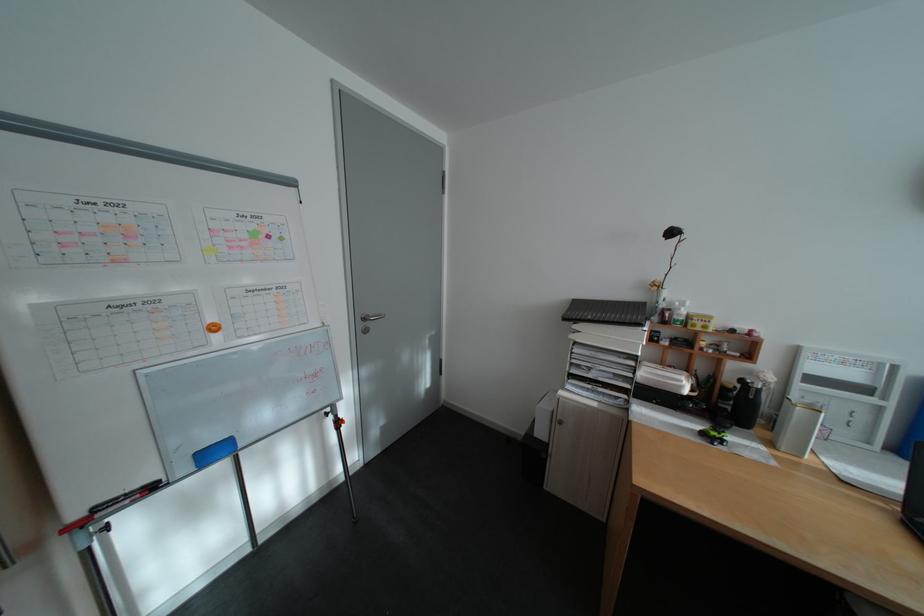
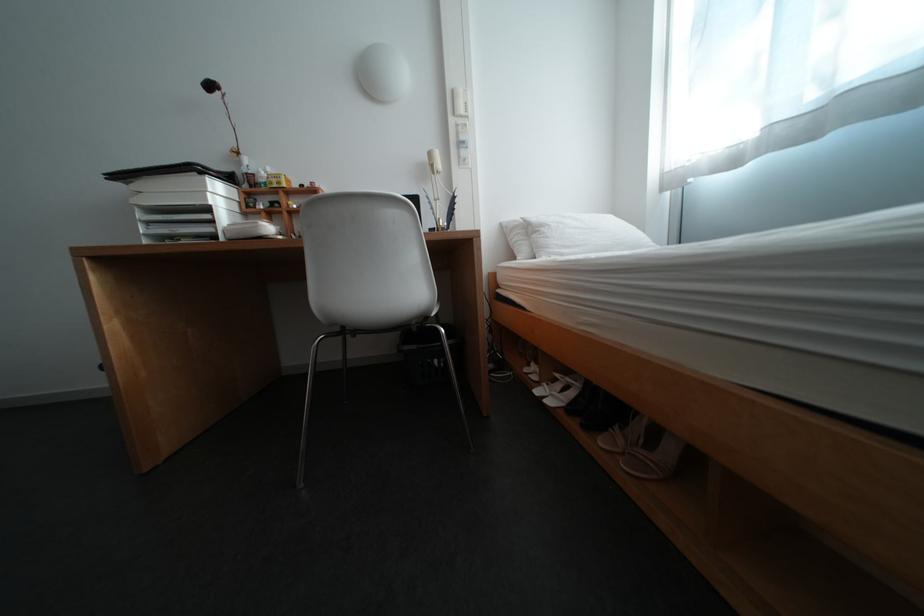
Locate, in the second image, the point that corresponds to the point at 695,382 in the first image.

(270, 224)